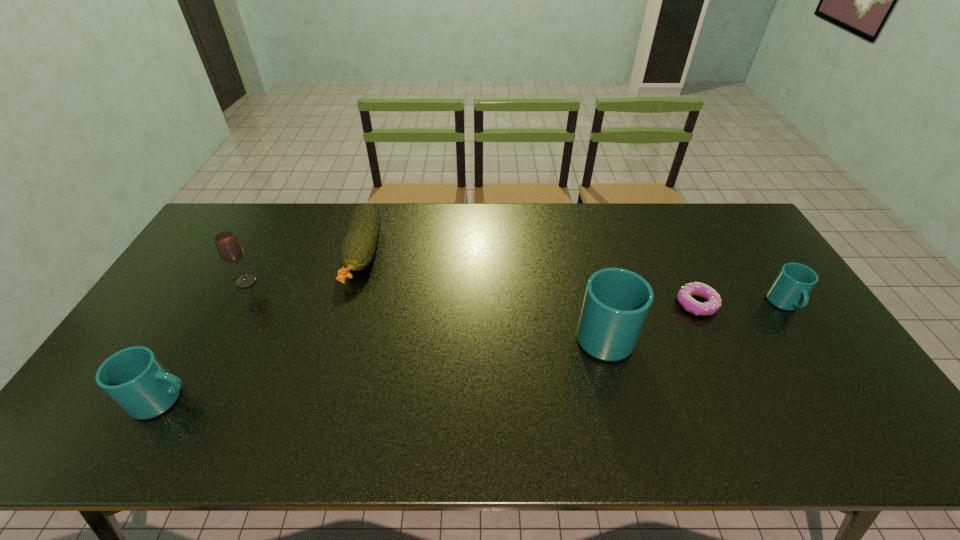
Select which cup appears as the second closest to the nearest cup. Please provide its 2D coordinates. Your answer should be formatted as a tuple, i.e. [(x, y)], where the tuple contains the x and y coordinates of a point satisfying the conditions above.

[(789, 291)]

Find the location of a particular element. The width and height of the screenshot is (960, 540). free space that satisfies the following two spatial constraints: 1. on the front side of the glass drink container; 2. on the right side of the shortest object is located at coordinates (234, 304).

Where is `free location that satisfies the following two spatial constraints: 1. at the blossom end of the third object from left to right; 2. on the left side of the shortest object`? Image resolution: width=960 pixels, height=540 pixels. free location that satisfies the following two spatial constraints: 1. at the blossom end of the third object from left to right; 2. on the left side of the shortest object is located at coordinates (348, 304).

Identify the location of free space that satisfies the following two spatial constraints: 1. on the front side of the glass drink container; 2. on the handle side of the nearest cup. (182, 400).